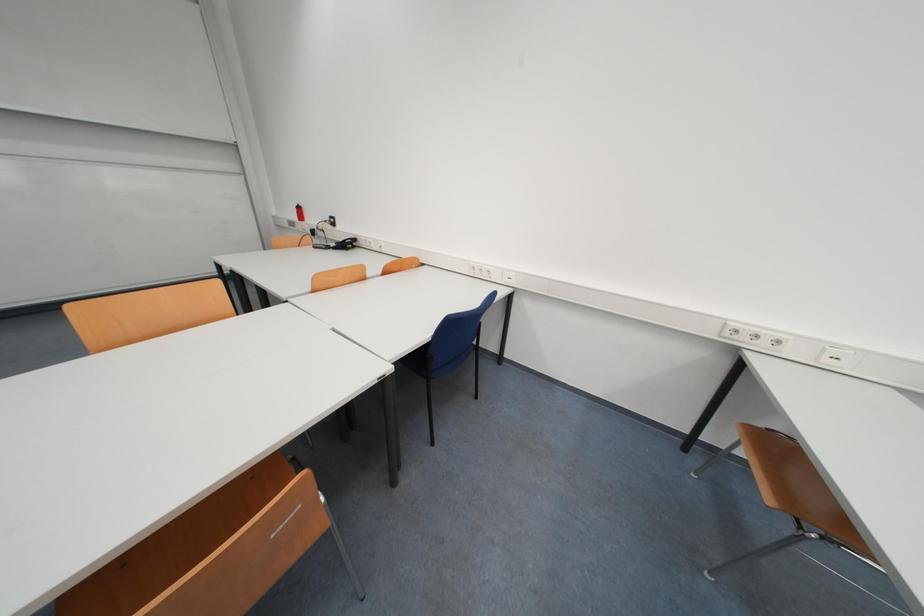
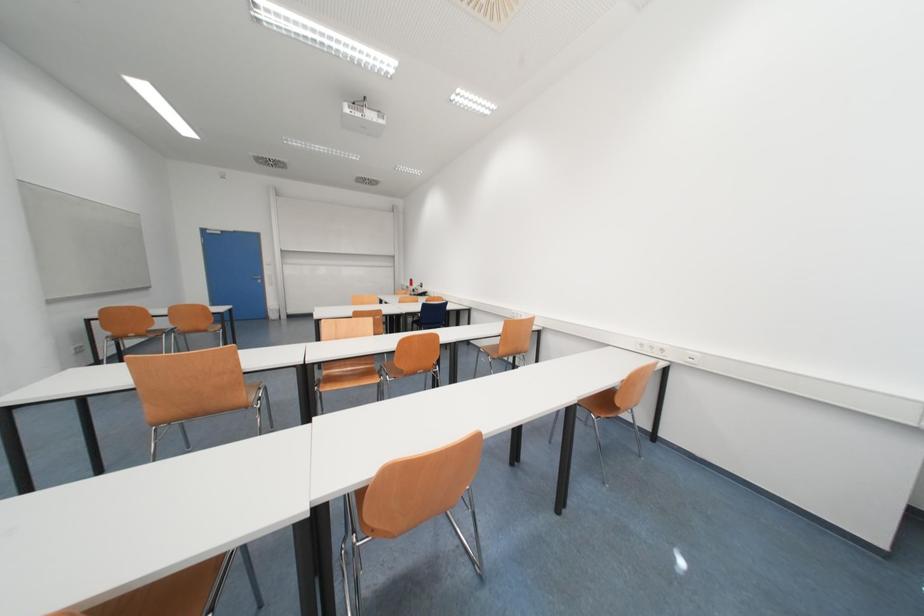
Which direction would the cameraman need to move to produce the second image?

The cameraman walked toward right, backward.